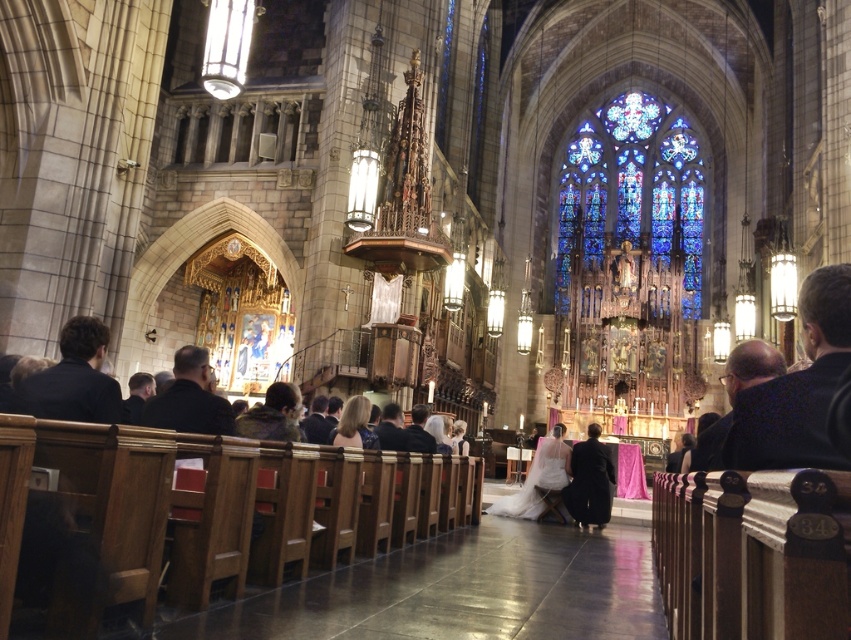
Question: Can you confirm if dark blue shirt at left is positioned below dark fabric coat at center?

Choices:
 (A) yes
 (B) no

Answer: (B)

Question: Which object appears farthest from the camera in this image?

Choices:
 (A) dark blue fabric at right
 (B) white satin dress at center

Answer: (B)

Question: Among these objects, which one is nearest to the camera?

Choices:
 (A) dark fabric coat at center
 (B) stained glass at center

Answer: (A)

Question: Does stained glass at center have a greater width compared to dark brown leather jacket at center?

Choices:
 (A) no
 (B) yes

Answer: (B)

Question: Does dark blue fabric at right appear over dark blue shirt at left?

Choices:
 (A) yes
 (B) no

Answer: (A)

Question: Which point is farther to the camera?

Choices:
 (A) (550, 438)
 (B) (214, 417)
 (C) (746, 449)

Answer: (A)